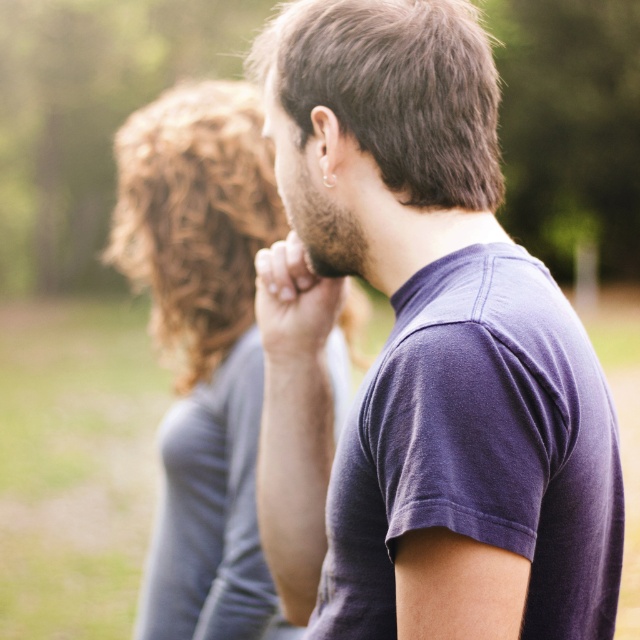
Question: Does smooth gray shirt at center appear under matte skin hand at center?

Choices:
 (A) yes
 (B) no

Answer: (A)

Question: Which object is the farthest from the smooth gray shirt at center?

Choices:
 (A) matte skin hand at center
 (B) purple cotton t-shirt at center

Answer: (B)

Question: Can you confirm if purple cotton t-shirt at center is positioned to the left of smooth gray shirt at center?

Choices:
 (A) no
 (B) yes

Answer: (A)

Question: Which point is farther to the camera?

Choices:
 (A) smooth gray shirt at center
 (B) matte skin hand at center

Answer: (A)

Question: Which is farther from the smooth gray shirt at center?

Choices:
 (A) purple cotton t-shirt at center
 (B) matte skin hand at center

Answer: (A)

Question: Where is purple cotton t-shirt at center located in relation to smooth gray shirt at center in the image?

Choices:
 (A) left
 (B) right

Answer: (B)